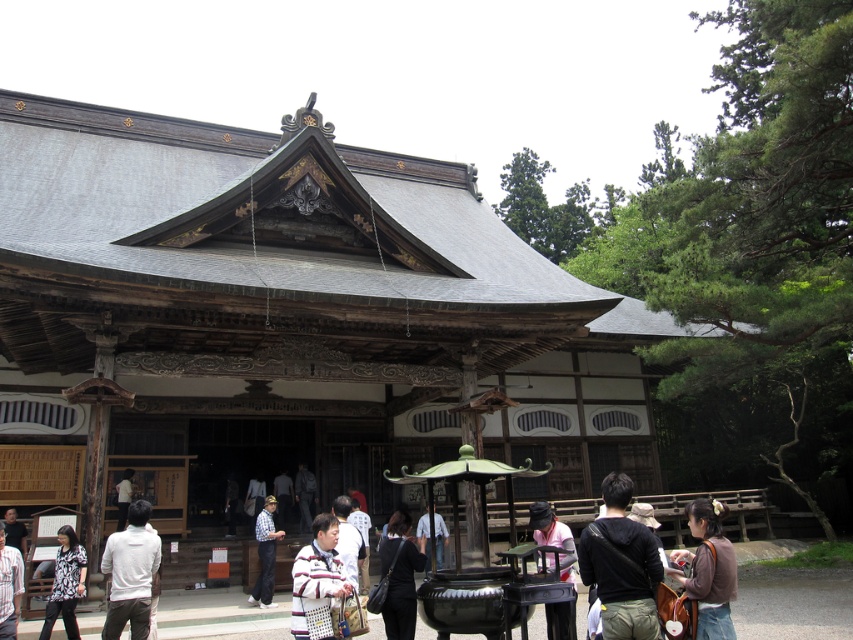
You are standing in front of the temple and see a black fabric backpack at lower right and a black fabric bag at center. Which one is positioned more to the right side?

The black fabric backpack at lower right is positioned more to the right side than the black fabric bag at center.